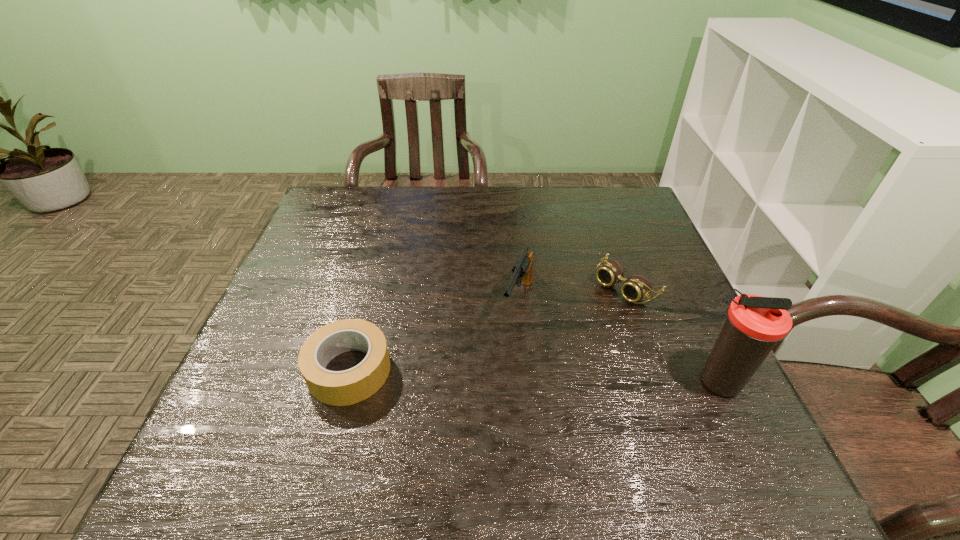
Where is `unoccupied position between the duct tape and the goggles`? This screenshot has width=960, height=540. unoccupied position between the duct tape and the goggles is located at coordinates (486, 328).

You are a GUI agent. You are given a task and a screenshot of the screen. Output one action in this format:
    pyautogui.click(x=<x>, y=<y>)
    Task: Click on the vacant area that lies between the duct tape and the third shortest object
    
    Given the screenshot: What is the action you would take?
    pyautogui.click(x=432, y=335)

Locate an element on the screen. free space that is in between the goggles and the third shortest object is located at coordinates (572, 294).

Find the location of a particular element. The image size is (960, 540). vacant point located between the thermos bottle and the goggles is located at coordinates (672, 334).

Image resolution: width=960 pixels, height=540 pixels. Identify the location of vacant point located between the tallest object and the goggles. (672, 334).

What are the coordinates of `empty space that is in between the goggles and the tallest object` in the screenshot? It's located at (672, 334).

This screenshot has height=540, width=960. I want to click on free space between the leftmost object and the thermos bottle, so click(533, 376).

Point out which object is positioned as the second nearest to the gun. Please provide its 2D coordinates. Your answer should be formatted as a tuple, i.e. [(x, y)], where the tuple contains the x and y coordinates of a point satisfying the conditions above.

[(337, 388)]

Identify which object is the second closest to the leftmost object. Please provide its 2D coordinates. Your answer should be formatted as a tuple, i.e. [(x, y)], where the tuple contains the x and y coordinates of a point satisfying the conditions above.

[(635, 288)]

Where is `blank space that satisfies the following two spatial constraints: 1. on the front side of the tallest object; 2. on the left side of the second tallest object`? blank space that satisfies the following two spatial constraints: 1. on the front side of the tallest object; 2. on the left side of the second tallest object is located at coordinates (526, 381).